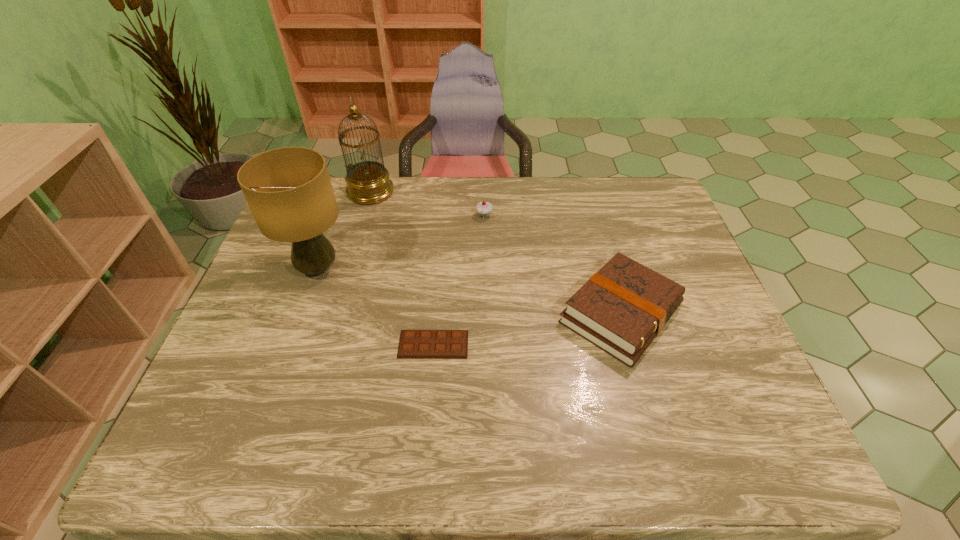
Identify the location of birdcage. (368, 182).

Locate an element on the screen. This screenshot has width=960, height=540. lampshade is located at coordinates (288, 189).

Identify the location of the third tallest object. The width and height of the screenshot is (960, 540). (483, 208).

Image resolution: width=960 pixels, height=540 pixels. In order to click on the second farthest object in this screenshot , I will do `click(483, 208)`.

This screenshot has height=540, width=960. In order to click on the rightmost object in this screenshot , I will do `click(621, 309)`.

This screenshot has width=960, height=540. I want to click on hardback book, so click(621, 309).

This screenshot has height=540, width=960. I want to click on the third object from left to right, so click(414, 344).

What are the coordinates of `the shortest object` in the screenshot? It's located at (414, 344).

Where is `vacant space located 0.180m with an open door on the farthest object`? The image size is (960, 540). vacant space located 0.180m with an open door on the farthest object is located at coordinates (447, 192).

Where is `free region located on the front of the lampshade`? The width and height of the screenshot is (960, 540). free region located on the front of the lampshade is located at coordinates (278, 377).